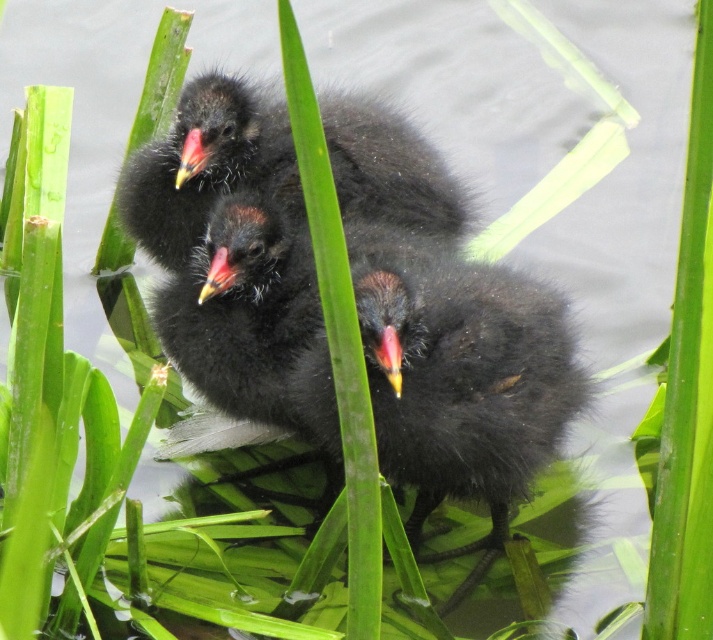
Consider the image. Between black fluffy birds at upper center and yellow-orange beak at center, which one is positioned lower?

yellow-orange beak at center

Between black fluffy birds at upper center and yellow-orange beak at center, which one is positioned higher?

black fluffy birds at upper center

Image resolution: width=713 pixels, height=640 pixels. I want to click on black fluffy birds at upper center, so click(x=207, y=164).